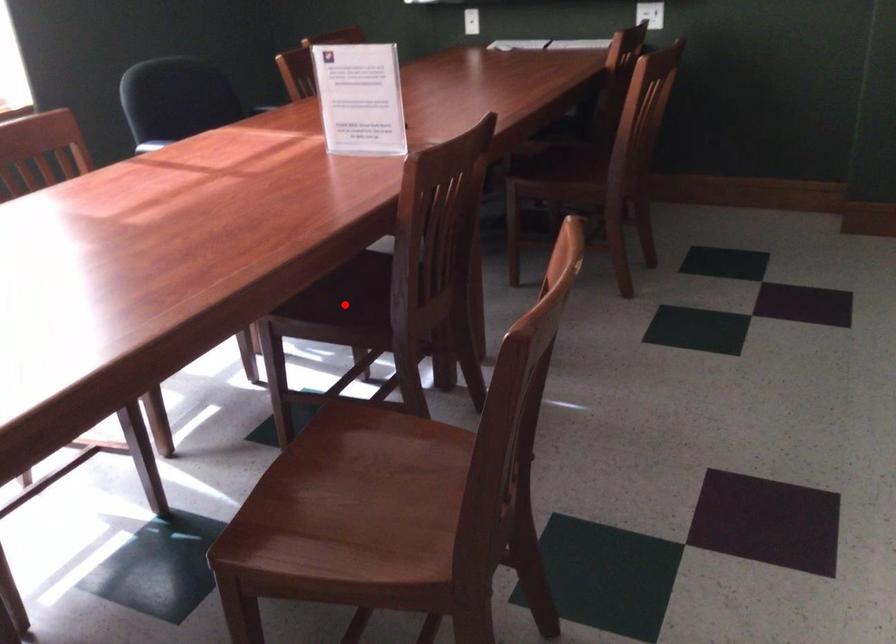
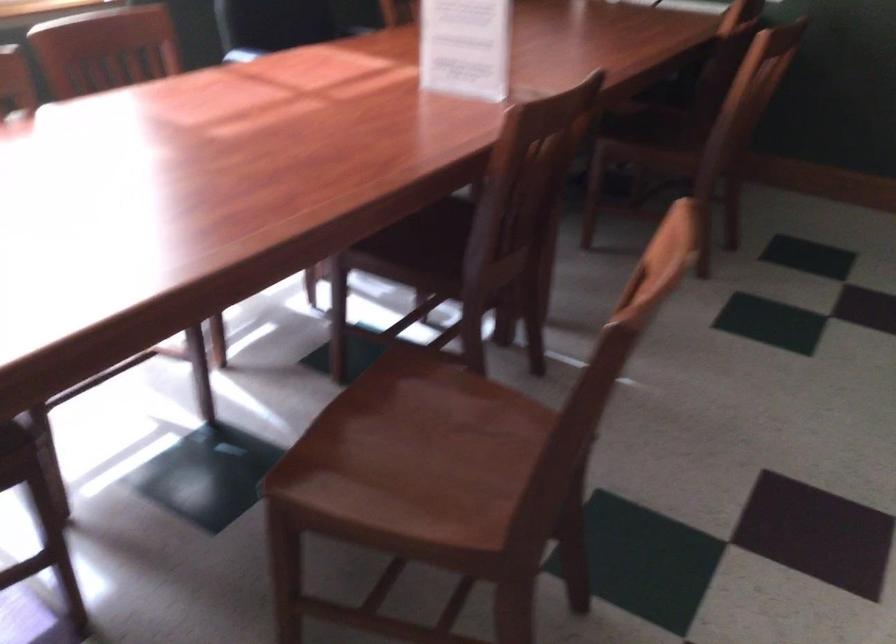
Locate, in the second image, the point that corresponds to the highlighted location in the first image.

(418, 247)